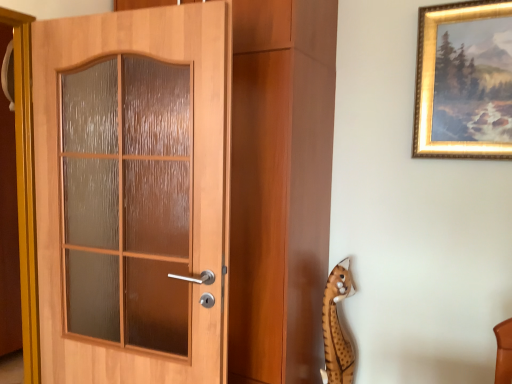
What do you see at coordinates (337, 328) in the screenshot? I see `spotted plush toy at lower right` at bounding box center [337, 328].

What is the approximate height of gold-framed painting at upper right?

gold-framed painting at upper right is 65.24 centimeters tall.

Locate an element on the screen. wooden door at left is located at coordinates (130, 194).

Considering the sizes of objects wooden door at left and gold-framed painting at upper right in the image provided, who is taller, wooden door at left or gold-framed painting at upper right?

With more height is wooden door at left.

Could you tell me if wooden door at left is facing gold-framed painting at upper right?

No, wooden door at left is not oriented towards gold-framed painting at upper right.

Considering their positions, is wooden door at left located in front of or behind gold-framed painting at upper right?

Visually, wooden door at left is located in front of gold-framed painting at upper right.

Find the location of a particular element. The height and width of the screenshot is (384, 512). door that is on the left side of gold-framed painting at upper right is located at coordinates (130, 194).

Does spotted plush toy at lower right come behind gold-framed painting at upper right?

Yes, the depth of spotted plush toy at lower right is greater than that of gold-framed painting at upper right.

From a real-world perspective, is spotted plush toy at lower right over gold-framed painting at upper right?

Actually, spotted plush toy at lower right is physically below gold-framed painting at upper right in the real world.

Considering the sizes of objects spotted plush toy at lower right and gold-framed painting at upper right in the image provided, who is smaller, spotted plush toy at lower right or gold-framed painting at upper right?

Smaller between the two is spotted plush toy at lower right.

Looking at this image, which is correct: spotted plush toy at lower right is inside gold-framed painting at upper right, or outside of it?

spotted plush toy at lower right is located beyond the bounds of gold-framed painting at upper right.

Is gold-framed painting at upper right positioned far away from spotted plush toy at lower right?

No, there isn't a large distance between gold-framed painting at upper right and spotted plush toy at lower right.

Is gold-framed painting at upper right surrounding spotted plush toy at lower right?

Definitely not — spotted plush toy at lower right is not inside gold-framed painting at upper right.

Is point (466, 135) closer or farther from the camera than point (327, 356)?

Clearly, point (466, 135) is closer to the camera than point (327, 356).

Can you confirm if wooden door at left is positioned to the right of spotted plush toy at lower right?

No, wooden door at left is not to the right of spotted plush toy at lower right.

Where is `door in front of the spotted plush toy at lower right`? The width and height of the screenshot is (512, 384). door in front of the spotted plush toy at lower right is located at coordinates (130, 194).

Based on the photo, is wooden door at left smaller than spotted plush toy at lower right?

No.

Considering the positions of objects spotted plush toy at lower right and wooden door at left in the image provided, who is more to the right, spotted plush toy at lower right or wooden door at left?

Positioned to the right is spotted plush toy at lower right.

From the image's perspective, would you say spotted plush toy at lower right is shown under wooden door at left?

Yes, from the image's perspective, spotted plush toy at lower right is beneath wooden door at left.

Is spotted plush toy at lower right inside or outside of wooden door at left?

spotted plush toy at lower right lies outside wooden door at left.

Is gold-framed painting at upper right placed right next to wooden door at left?

No.

From the image's perspective, which is below, gold-framed painting at upper right or wooden door at left?

wooden door at left.

Which is more to the right, gold-framed painting at upper right or wooden door at left?

Positioned to the right is gold-framed painting at upper right.

Which is behind, point (490, 24) or point (74, 136)?

Point (74, 136)

This screenshot has width=512, height=384. I want to click on picture frame lying on the right of wooden door at left, so [464, 81].

You are a GUI agent. You are given a task and a screenshot of the screen. Output one action in this format:
    pyautogui.click(x=<x>, y=<y>)
    Task: Click on the animal below the gold-framed painting at upper right (from the image's perspective)
    
    Given the screenshot: What is the action you would take?
    pyautogui.click(x=337, y=328)

From the picture: Considering their positions, is spotted plush toy at lower right positioned closer to wooden door at left than gold-framed painting at upper right?

spotted plush toy at lower right is positioned closer to the anchor wooden door at left.

Estimate the real-world distances between objects in this image. Which object is further from wooden door at left, gold-framed painting at upper right or spotted plush toy at lower right?

gold-framed painting at upper right is further to wooden door at left.

Looking at the image, which one is located closer to spotted plush toy at lower right, gold-framed painting at upper right or wooden door at left?

gold-framed painting at upper right is positioned closer to the anchor spotted plush toy at lower right.

Based on their spatial positions, is wooden door at left or gold-framed painting at upper right further from spotted plush toy at lower right?

wooden door at left is positioned further to the anchor spotted plush toy at lower right.

When comparing their distances from gold-framed painting at upper right, does spotted plush toy at lower right or wooden door at left seem further?

wooden door at left.

When comparing their distances from gold-framed painting at upper right, does wooden door at left or spotted plush toy at lower right seem further?

wooden door at left.

At what (x,y) coordinates should I click in order to perform the action: click on animal between wooden door at left and gold-framed painting at upper right in the horizontal direction. Please return your answer as a coordinate pair (x, y). This screenshot has width=512, height=384. Looking at the image, I should click on (337, 328).